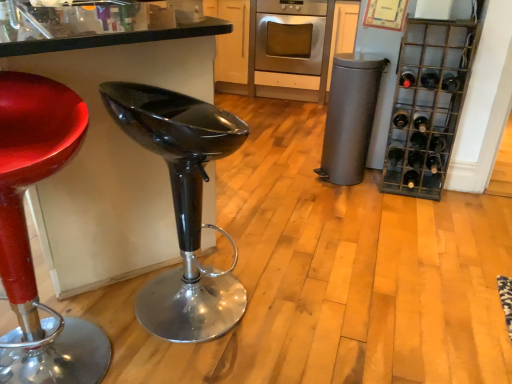
Where is `unoccupied space behind glossy black stool at center`? unoccupied space behind glossy black stool at center is located at coordinates (251, 243).